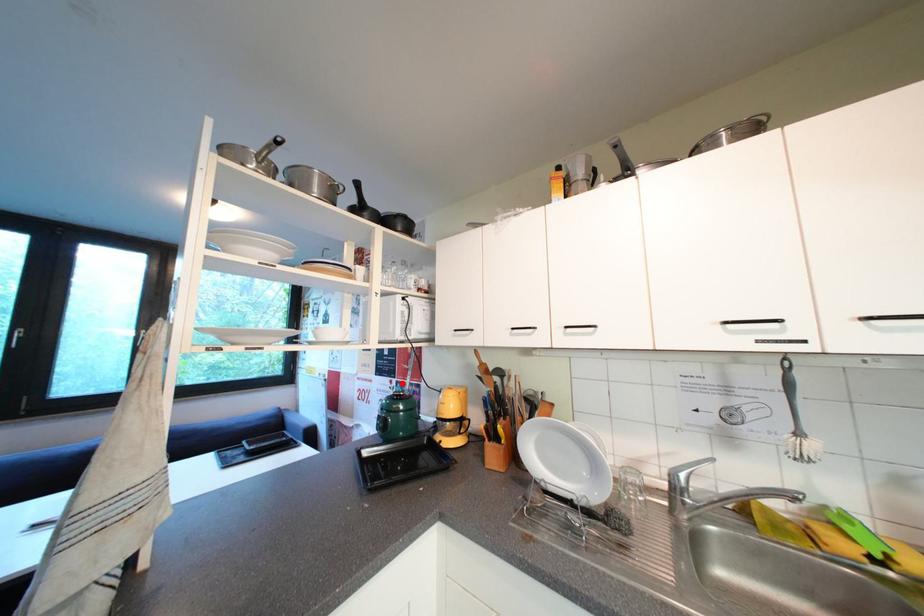
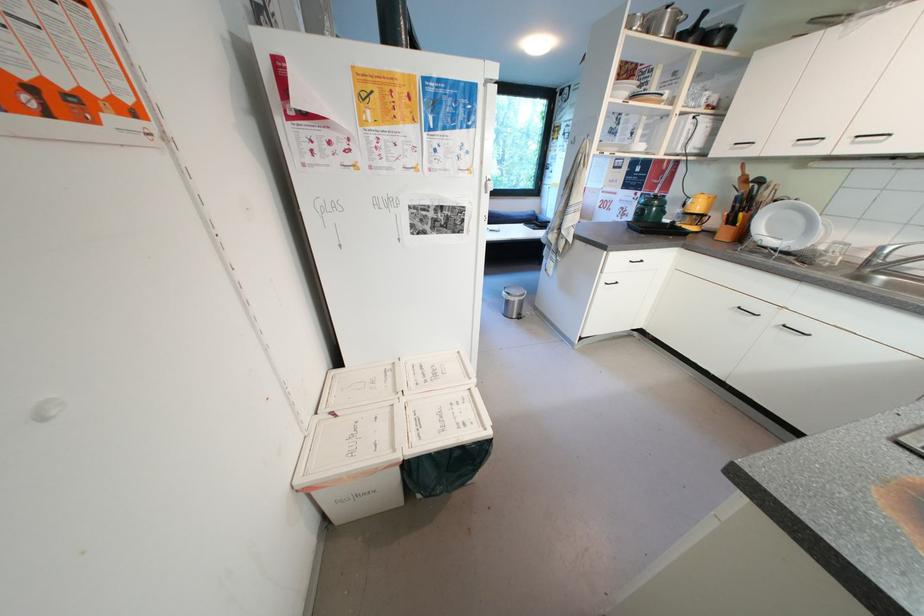
Question: A red point is marked in image1. In image2, is the corresponding 3D point closer to the camera or farther? Reply with the corresponding letter.

Choices:
 (A) The corresponding 3D point is closer.
 (B) The corresponding 3D point is farther.

Answer: (A)